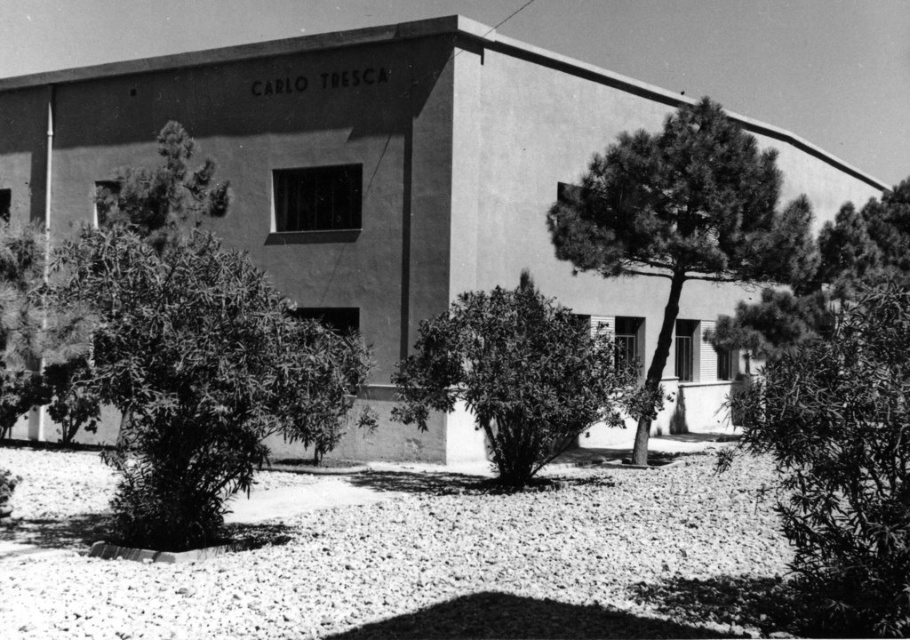
You are standing in front of the CARLO TRESCA building and want to take a photo. You notice two points marked on the building facade at coordinates point (x=846, y=566) and point (x=761, y=184). Which point will appear larger in your camera view?

Point (x=846, y=566) is closer to the camera than point (x=761, y=184), so it will appear larger in the camera view.

You are standing in front of the CARLO TRESCA building and notice a green leafy bush at center. Based on its position, can you determine if it is closer to the building or the street?

The green leafy bush at center is located at point (514, 376), which places it closer to the building than the street.